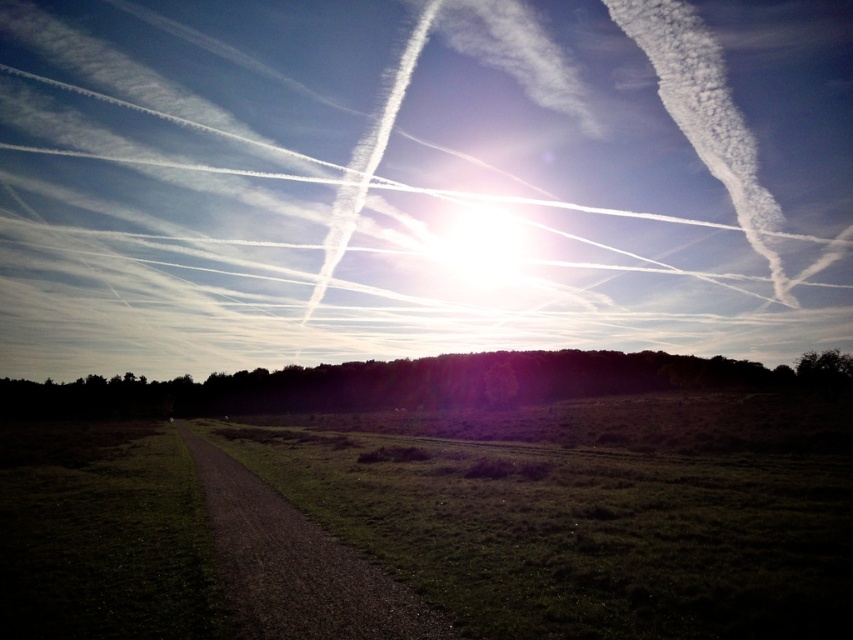
Who is taller, green grassy field at lower center or dirt/gravel path at lower left?

With more height is green grassy field at lower center.

Between green grassy field at lower center and dirt/gravel path at lower left, which one is positioned lower?

dirt/gravel path at lower left is below.

Between point (473, 550) and point (389, 620), which one is positioned behind?

The point (473, 550) is behind.

Image resolution: width=853 pixels, height=640 pixels. What are the coordinates of `green grassy field at lower center` in the screenshot? It's located at (579, 531).